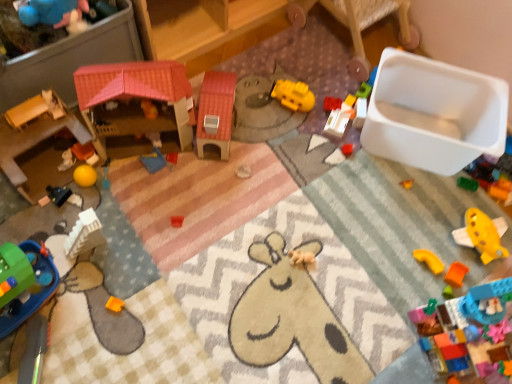
Where is `empty space that is in between green plastic toy at lower left, the fourteenth toy viewed from the right, and blue plastic tray at center, which ranks as the 10th toy in right-to-left order`? empty space that is in between green plastic toy at lower left, the fourteenth toy viewed from the right, and blue plastic tray at center, which ranks as the 10th toy in right-to-left order is located at coordinates (111, 214).